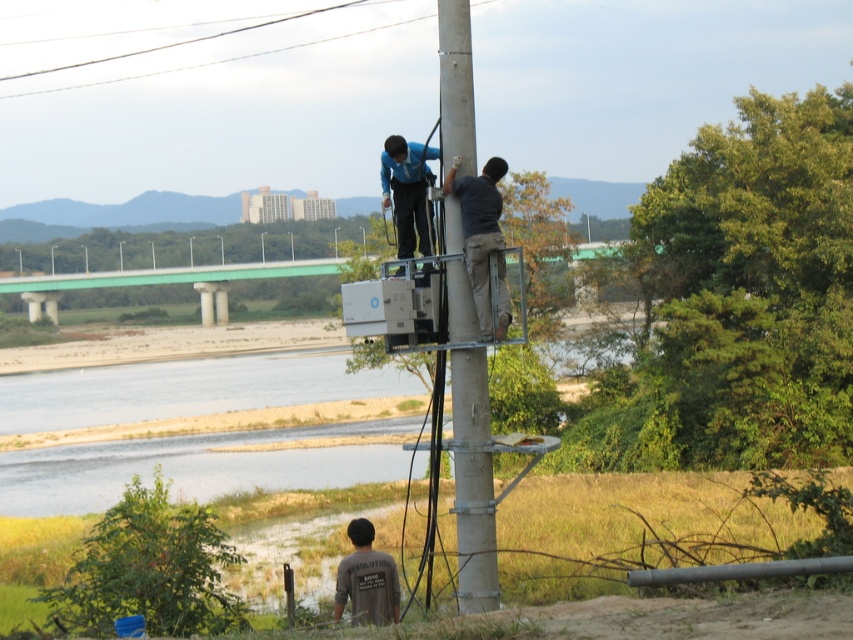
Question: Is concrete pole at center wider than dark gray fabric pants at center?

Choices:
 (A) yes
 (B) no

Answer: (B)

Question: Which of these objects is positioned closest to the dark gray fabric pants at center?

Choices:
 (A) blue fabric construction worker at upper center
 (B) concrete pole at center
 (C) dark gray cotton shirt at lower center
 (D) metallic wire at upper center

Answer: (B)

Question: Which point appears closest to the camera in this image?

Choices:
 (A) (372, 532)
 (B) (454, 468)
 (C) (73, 88)

Answer: (B)

Question: Can you confirm if concrete pole at center is thinner than blue fabric construction worker at upper center?

Choices:
 (A) no
 (B) yes

Answer: (B)

Question: Which point is farther to the camera?

Choices:
 (A) blue fabric construction worker at upper center
 (B) dark gray cotton shirt at lower center
 (C) dark gray fabric pants at center
 (D) metallic wire at upper center

Answer: (D)

Question: Does dark gray cotton shirt at lower center have a smaller size compared to metallic wire at upper center?

Choices:
 (A) yes
 (B) no

Answer: (A)